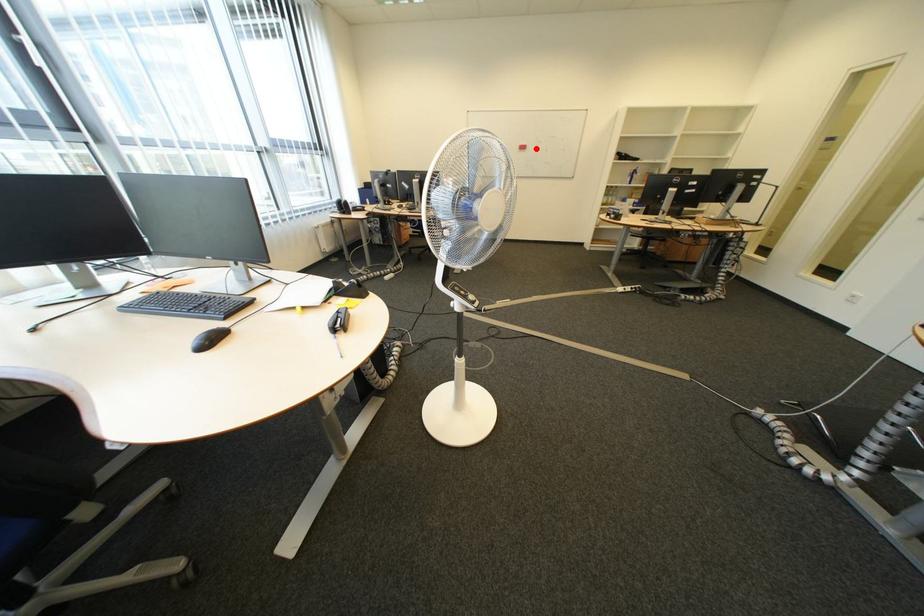
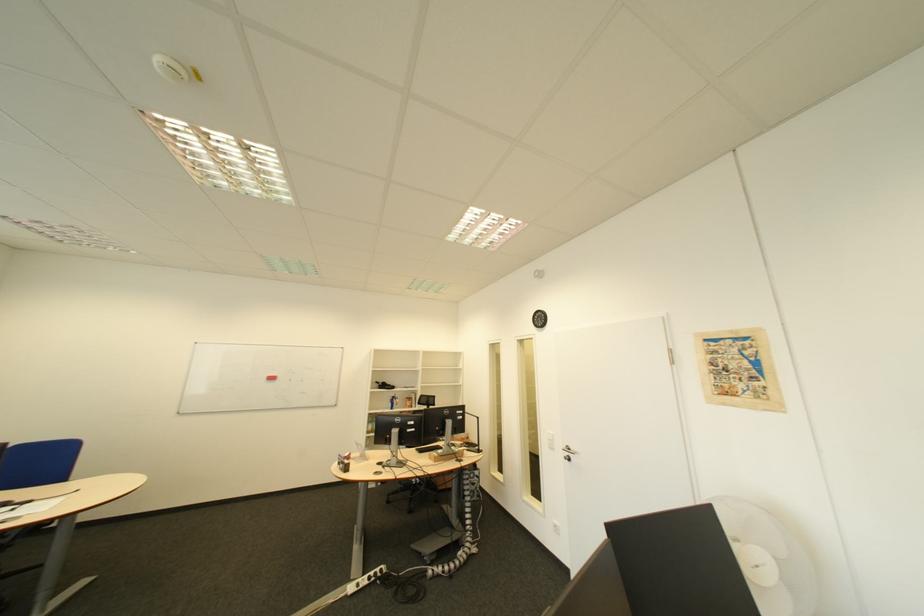
Where in the second image is the point corresponding to the highlighted location from the first image?

(285, 379)